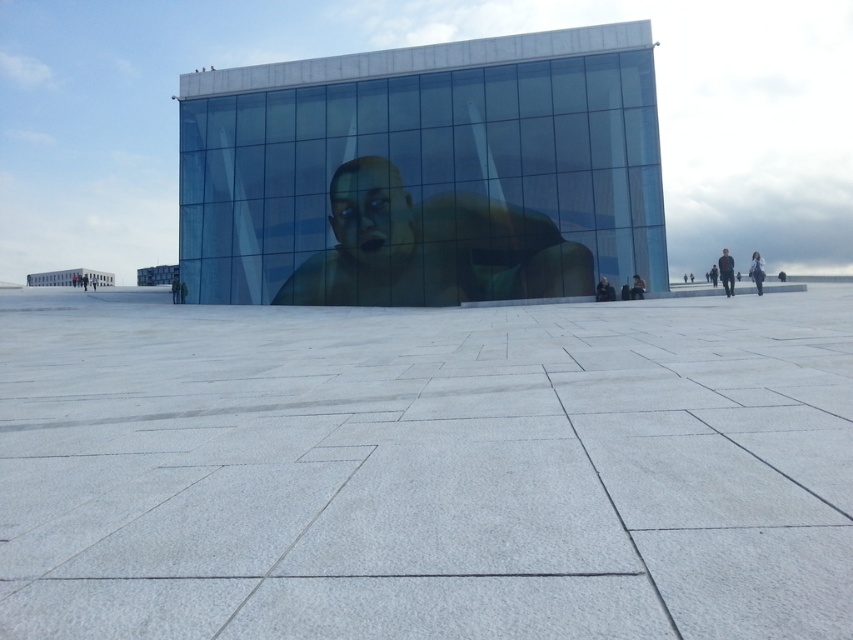
You are standing in front of the modern building and want to take a photo of the matte black person at center. Since the white polished stone plaza at center is in the way, can you move around it to get a clear shot?

The white polished stone plaza at center is closer to the viewer than the matte black person at center, so you can move to the side of the plaza to get a clear view of the matte black person at center.

You are standing at the base of the building and notice two points marked on the plaza tiles. The first point is labeled as point (715, 378) and the second as point (640, 285). If you want to walk towards the building, which point would you encounter first?

Point (640, 285) would be encountered first because it is closer to the building compared to point (715, 378), which is positioned further away from the building.